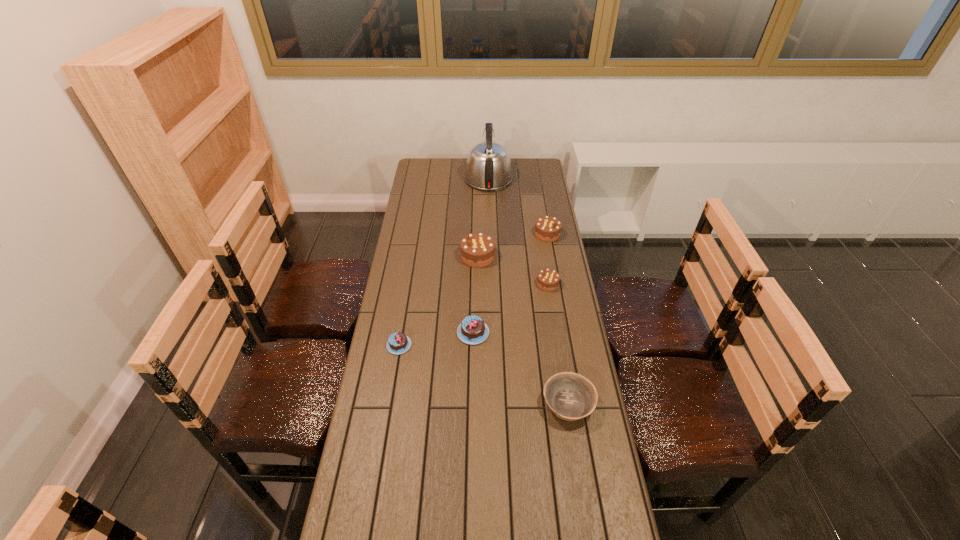
I want to click on the shortest object, so click(x=398, y=343).

Where is `the left pink chocolate cake`? The width and height of the screenshot is (960, 540). the left pink chocolate cake is located at coordinates (398, 343).

Identify the location of vacant space positioned 0.050m on the spout of the farthest object. This screenshot has height=540, width=960. pos(488,158).

This screenshot has width=960, height=540. In order to click on free spot located on the front of the fifth nearest object in this screenshot , I will do `click(478, 290)`.

The image size is (960, 540). Identify the location of vacant space located 0.280m on the left of the second tallest chocolate cake. (474, 234).

Identify the location of free space located on the front of the smallest brown chocolate cake. (558, 346).

This screenshot has height=540, width=960. I want to click on vacant space located 0.260m on the left of the bigger pink chocolate cake, so click(387, 333).

This screenshot has height=540, width=960. In order to click on free space located 0.370m on the left of the nearest object in this screenshot , I will do `click(427, 404)`.

Identify the location of vacant space situated 0.330m on the back of the shortest object. pyautogui.click(x=411, y=274).

The height and width of the screenshot is (540, 960). I want to click on object present at the far edge, so click(x=488, y=167).